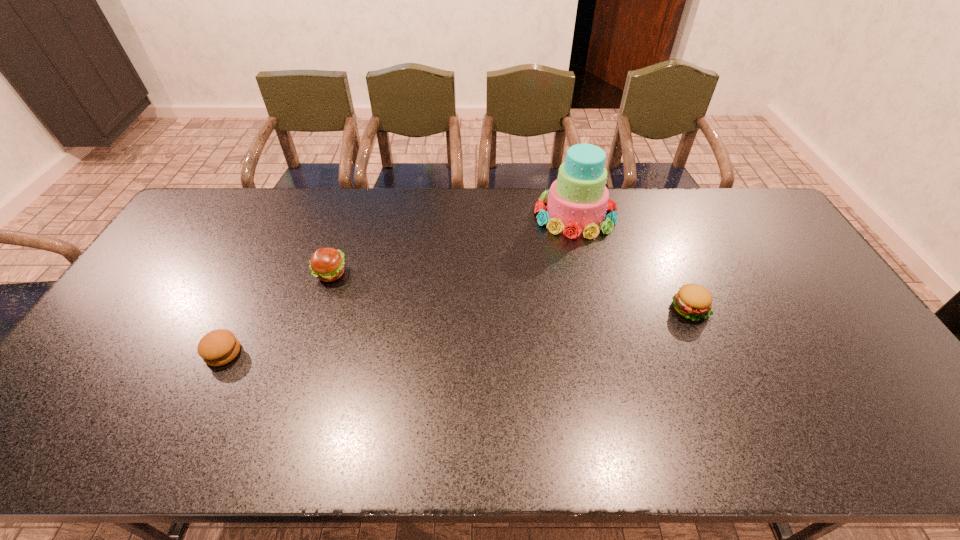
Where is `the second closest hamburger to the tallest object`? the second closest hamburger to the tallest object is located at coordinates (327, 264).

Where is `free space that satisfies the following two spatial constraints: 1. on the back side of the shortest object; 2. on the left side of the tallest object`? free space that satisfies the following two spatial constraints: 1. on the back side of the shortest object; 2. on the left side of the tallest object is located at coordinates (290, 214).

Find the location of a particular element. free point that satisfies the following two spatial constraints: 1. on the back side of the leftmost hamburger; 2. on the right side of the tallest object is located at coordinates [x=290, y=214].

Locate an element on the screen. vacant space that satisfies the following two spatial constraints: 1. on the back side of the farthest object; 2. on the right side of the leftmost hamburger is located at coordinates (290, 214).